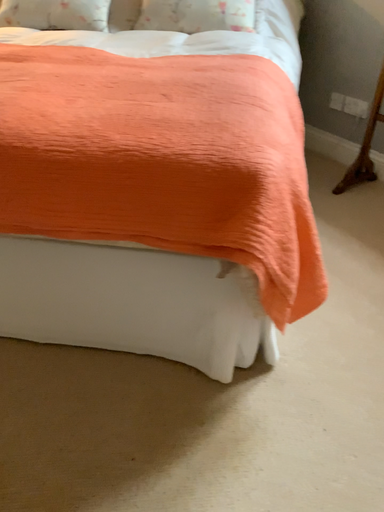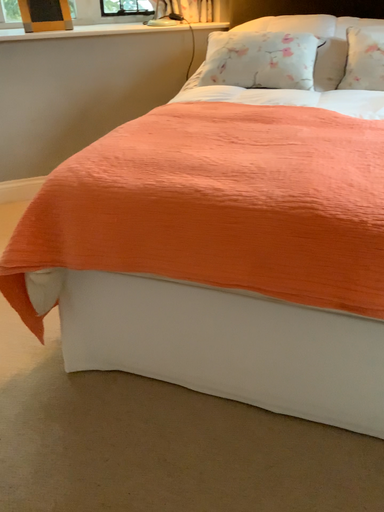
Question: Which way did the camera rotate in the video?

Choices:
 (A) rotated left
 (B) rotated right

Answer: (A)